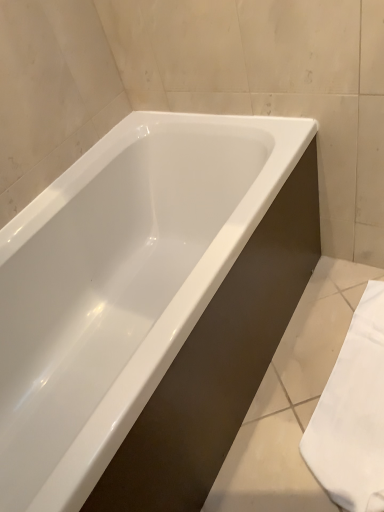
Question: Considering the relative sizes of white glossy bathtub at center and white fabric towel at lower right in the image provided, is white glossy bathtub at center smaller than white fabric towel at lower right?

Choices:
 (A) yes
 (B) no

Answer: (B)

Question: Does white glossy bathtub at center have a larger size compared to white fabric towel at lower right?

Choices:
 (A) yes
 (B) no

Answer: (A)

Question: Is white glossy bathtub at center to the right of white fabric towel at lower right from the viewer's perspective?

Choices:
 (A) no
 (B) yes

Answer: (A)

Question: Is white glossy bathtub at center oriented towards white fabric towel at lower right?

Choices:
 (A) no
 (B) yes

Answer: (B)

Question: Does white glossy bathtub at center appear on the left side of white fabric towel at lower right?

Choices:
 (A) no
 (B) yes

Answer: (B)

Question: From a real-world perspective, is white glossy bathtub at center positioned over white fabric towel at lower right based on gravity?

Choices:
 (A) no
 (B) yes

Answer: (B)

Question: From a real-world perspective, is white fabric towel at lower right located beneath white glossy bathtub at center?

Choices:
 (A) yes
 (B) no

Answer: (A)

Question: Is white fabric towel at lower right at the right side of white glossy bathtub at center?

Choices:
 (A) no
 (B) yes

Answer: (B)

Question: Does white fabric towel at lower right touch white glossy bathtub at center?

Choices:
 (A) no
 (B) yes

Answer: (A)

Question: Is white fabric towel at lower right in front of white glossy bathtub at center?

Choices:
 (A) yes
 (B) no

Answer: (B)

Question: From the image's perspective, does white fabric towel at lower right appear lower than white glossy bathtub at center?

Choices:
 (A) no
 (B) yes

Answer: (B)

Question: Would you say white fabric towel at lower right is outside white glossy bathtub at center?

Choices:
 (A) no
 (B) yes

Answer: (B)

Question: Looking at their shapes, would you say white glossy bathtub at center is wider or thinner than white fabric towel at lower right?

Choices:
 (A) thin
 (B) wide

Answer: (B)